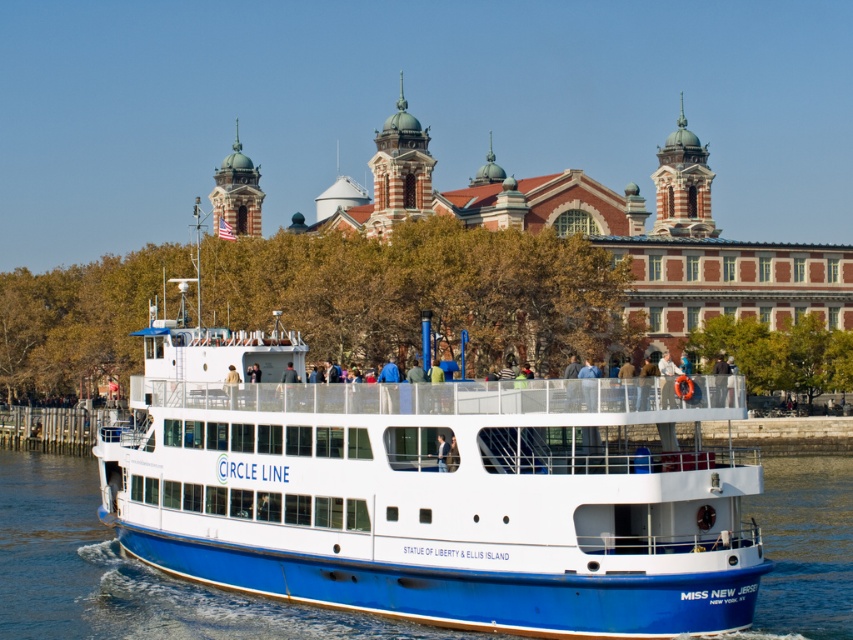
Question: Does blue matte ferry at center have a larger size compared to blue smooth water at lower center?

Choices:
 (A) no
 (B) yes

Answer: (B)

Question: Observing the image, what is the correct spatial positioning of blue matte ferry at center in reference to blue smooth water at lower center?

Choices:
 (A) left
 (B) right

Answer: (B)

Question: Is blue matte ferry at center to the left of blue smooth water at lower center from the viewer's perspective?

Choices:
 (A) yes
 (B) no

Answer: (B)

Question: Among these points, which one is nearest to the camera?

Choices:
 (A) (837, 540)
 (B) (201, 461)

Answer: (B)